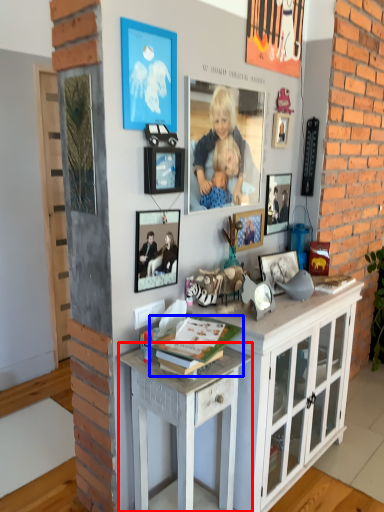
Question: Which object is further to the camera taking this photo, desk (highlighted by a red box) or magazine (highlighted by a blue box)?

Choices:
 (A) desk
 (B) magazine

Answer: (A)